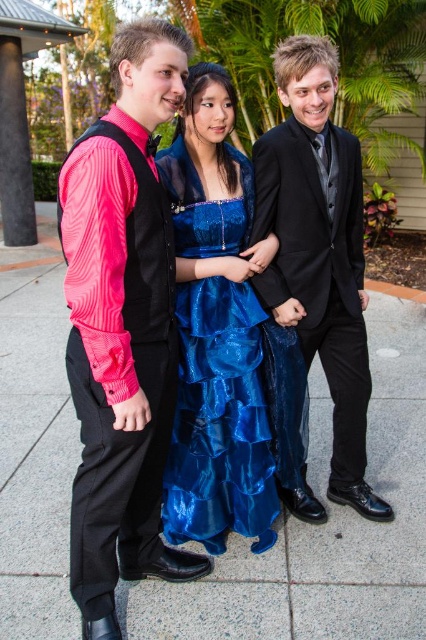
Does pink striped shirt at left have a lesser height compared to black satin suit at center?

No, pink striped shirt at left is not shorter than black satin suit at center.

Can you confirm if pink striped shirt at left is taller than black satin suit at center?

Yes.

Does point (106, 532) lie behind point (354, 148)?

That is False.

The width and height of the screenshot is (426, 640). I want to click on pink striped shirt at left, so click(123, 326).

Which is more to the right, slate gray pavement at center or pink striped shirt at left?

Positioned to the right is pink striped shirt at left.

Describe the element at coordinates (325, 528) in the screenshot. The height and width of the screenshot is (640, 426). I see `slate gray pavement at center` at that location.

Identify the location of slate gray pavement at center. (325, 528).

Who is lower down, slate gray pavement at center or black satin suit at center?

Positioned lower is slate gray pavement at center.

Which is in front, point (279, 618) or point (382, 508)?

Point (279, 618) is more forward.

Image resolution: width=426 pixels, height=640 pixels. I want to click on slate gray pavement at center, so click(325, 528).